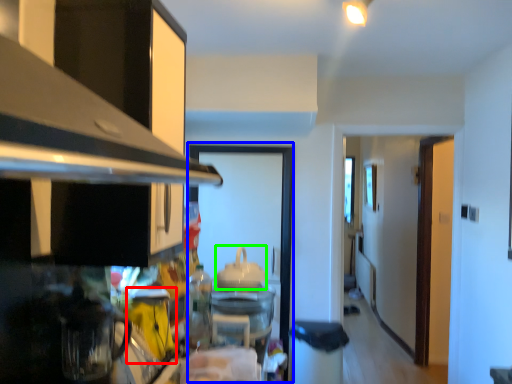
Question: Considering the real-world distances, which object is farthest from appliance (highlighted by a red box)? glass door (highlighted by a blue box) or appliance (highlighted by a green box)?

Choices:
 (A) glass door
 (B) appliance

Answer: (A)